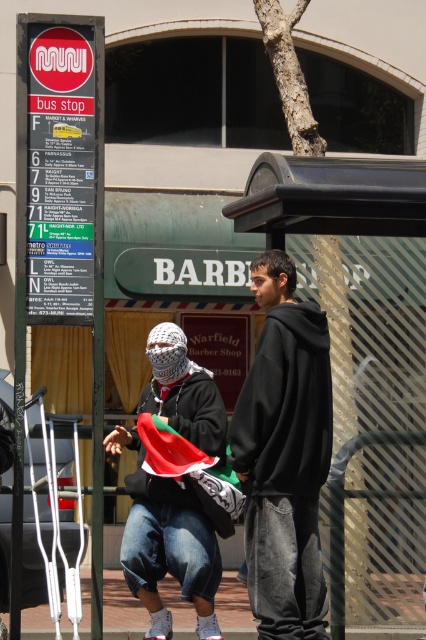
Question: Which object appears closest to the camera in this image?

Choices:
 (A) matte black hoodie at center
 (B) white knitted headscarf at center
 (C) black plastic bus stop at center

Answer: (C)

Question: Does brick pavement at lower center appear on the right side of white knitted headscarf at center?

Choices:
 (A) no
 (B) yes

Answer: (B)

Question: Which object is positioned farthest from the metallic silver crutches at lower left?

Choices:
 (A) brick pavement at lower center
 (B) black cotton hoodie at center

Answer: (A)

Question: Which object is closer to the camera taking this photo?

Choices:
 (A) white knitted headscarf at center
 (B) black cotton hoodie at center

Answer: (B)

Question: Is brick pavement at lower center to the left of white knitted headscarf at center from the viewer's perspective?

Choices:
 (A) yes
 (B) no

Answer: (B)

Question: Does black plastic bus stop at center have a greater width compared to white knitted headscarf at center?

Choices:
 (A) no
 (B) yes

Answer: (B)